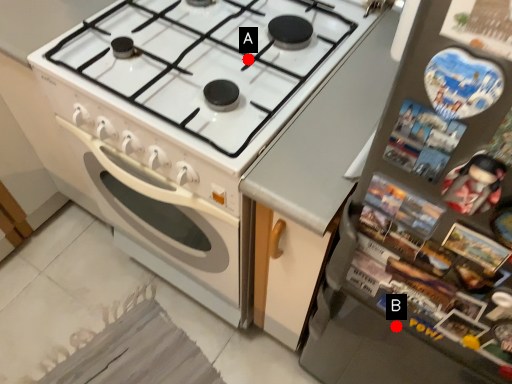
Question: Two points are circled on the image, labeled by A and B beside each circle. Which of the following is the farthest from the observer?

Choices:
 (A) A is further
 (B) B is further

Answer: (A)